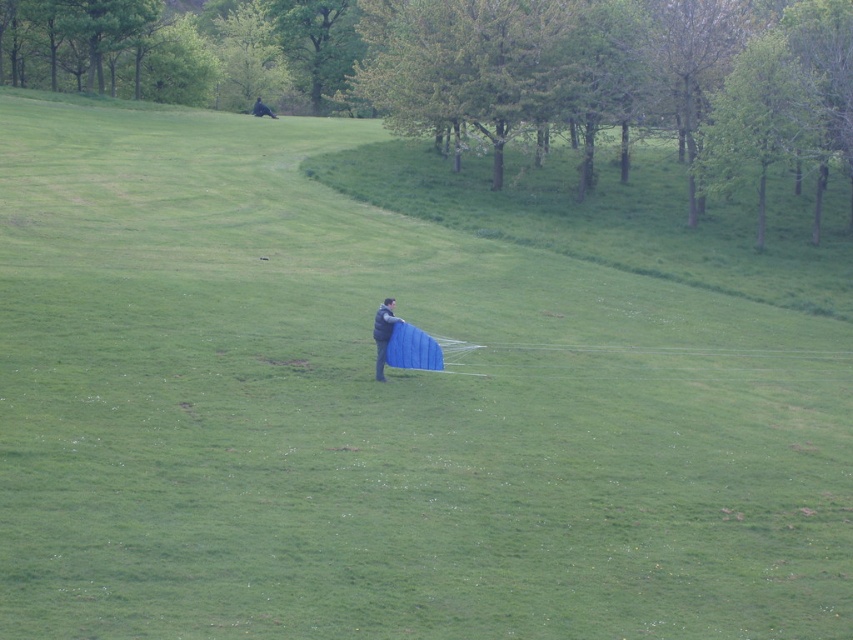
From the picture: You are a bird flying over the green leafy tree at upper center and the dark blue fabric at upper center. Which one has a larger width from your perspective?

The green leafy tree at upper center might be wider than dark blue fabric at upper center according to the description.

You are a photographer trying to capture the dark gray fabric kite at center without the green leafy tree at upper center blocking it. What adjustment should you make to your camera angle?

Lower your camera angle so the green leafy tree at upper center is no longer blocking the dark gray fabric kite at center.

You are standing in the grassy field and see the dark gray fabric kite at center and the dark blue fabric at upper center. Which object is positioned to the right side?

The dark gray fabric kite at center is to the right of the dark blue fabric at upper center.